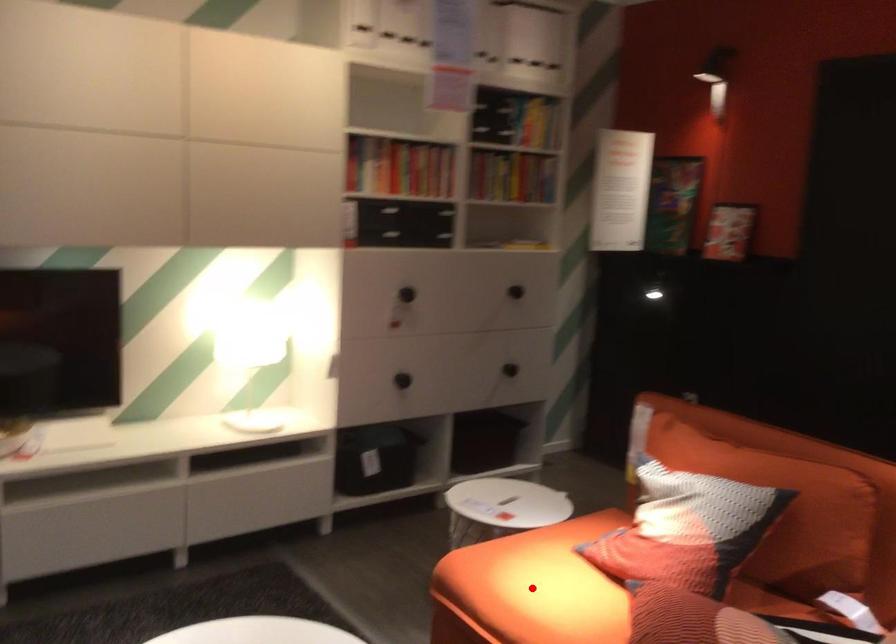
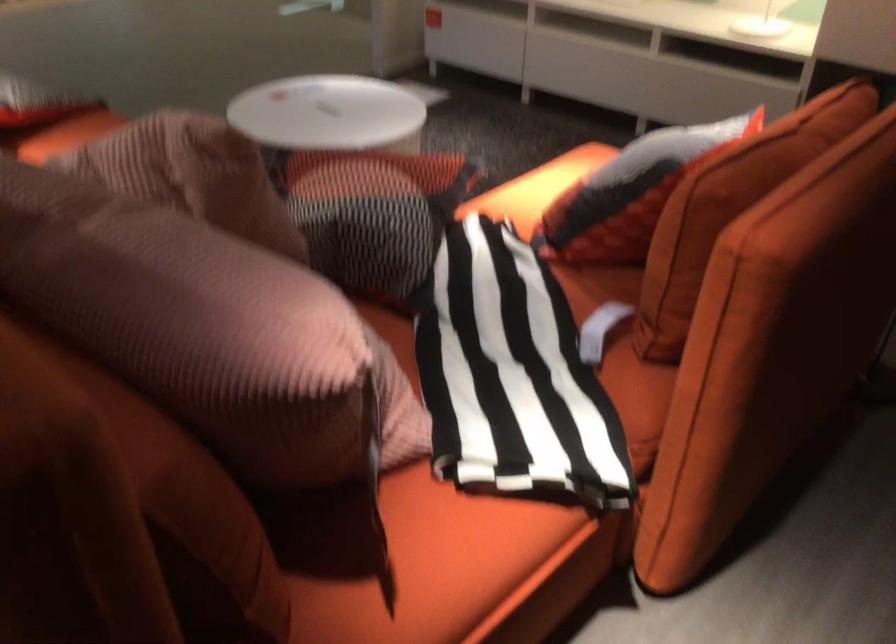
Question: I am providing you with two images of the same scene from different viewpoints. A red point is marked on the first image. Can you still see the location of the red point in image 2?

Choices:
 (A) Yes
 (B) No

Answer: (B)